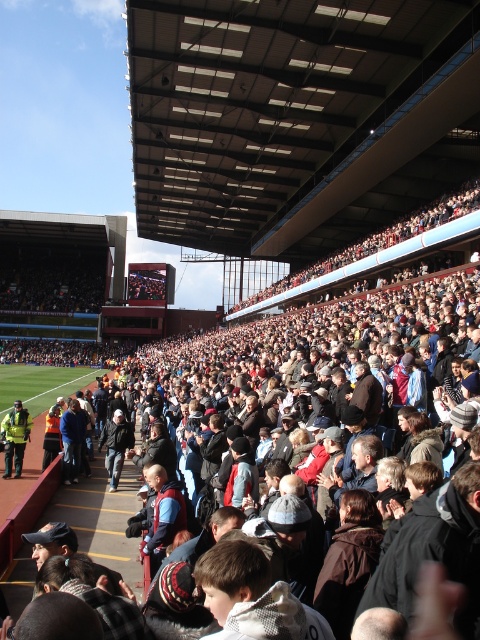
Question: Can you confirm if dark brown leather jacket at center is positioned above yellow reflective jacket at lower left?

Choices:
 (A) no
 (B) yes

Answer: (B)

Question: From the image, what is the correct spatial relationship of dark brown leather jacket at center in relation to yellow reflective jacket at lower left?

Choices:
 (A) below
 (B) above

Answer: (B)

Question: Which point is farther to the camera?

Choices:
 (A) (11, 465)
 (B) (331, 604)

Answer: (A)

Question: Which of the following is the closest to the observer?

Choices:
 (A) tap(15, 452)
 (B) tap(129, 392)

Answer: (A)

Question: Does dark brown leather jacket at center have a smaller size compared to yellow reflective jacket at lower left?

Choices:
 (A) yes
 (B) no

Answer: (B)